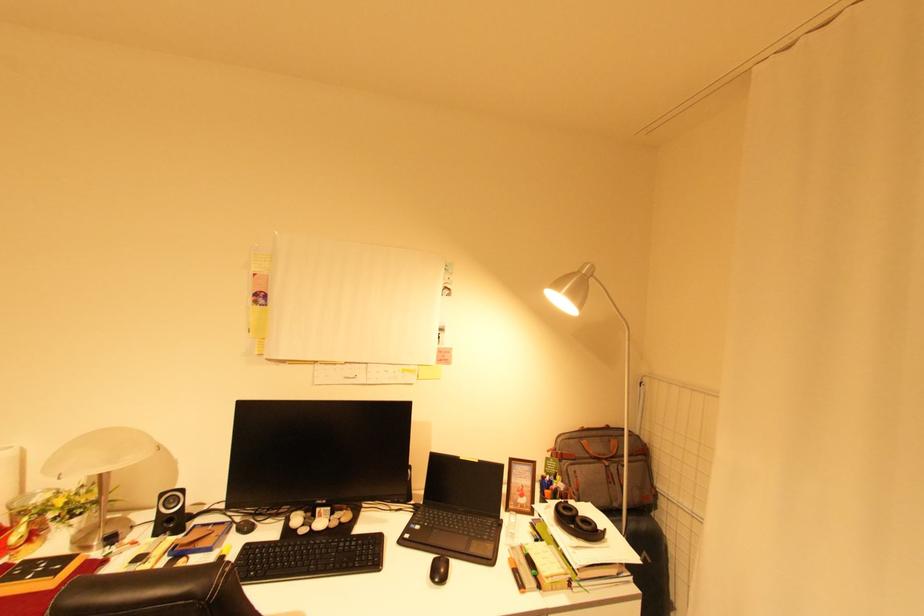
Where would you adjust the silver lamp head? Please return your answer as a coordinate pair (x, y).

(570, 291)